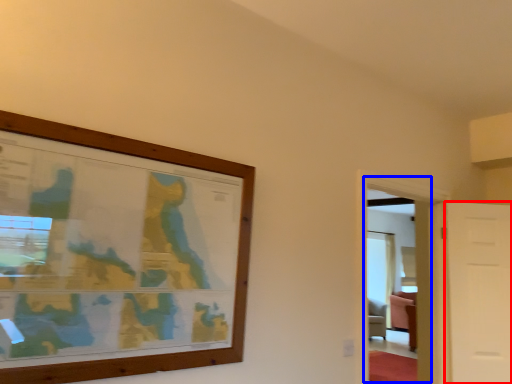
Question: Which object appears farthest to the camera in this image, door (highlighted by a red box) or glass door (highlighted by a blue box)?

Choices:
 (A) door
 (B) glass door

Answer: (A)